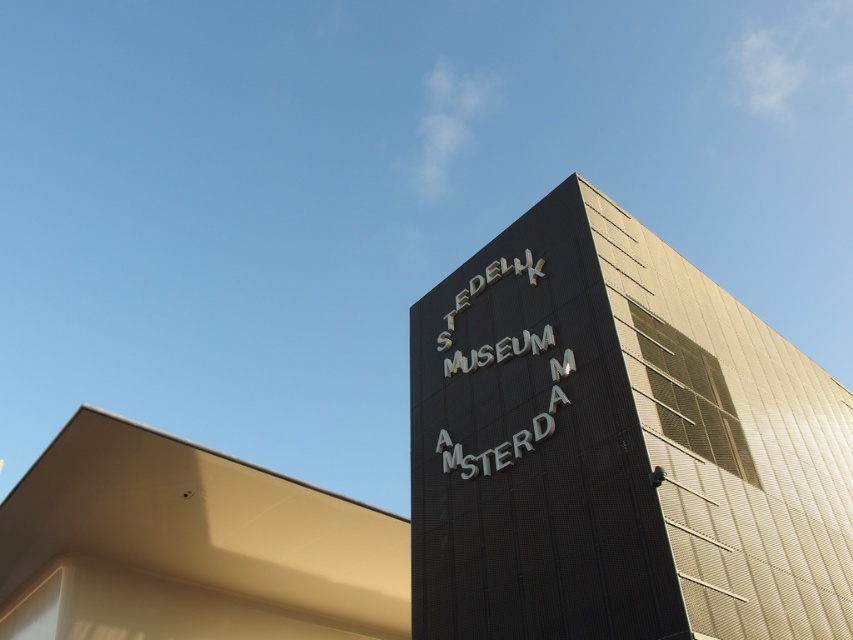
Question: Does black metallic sign at upper right have a lesser width compared to smooth beige roof at upper left?

Choices:
 (A) no
 (B) yes

Answer: (B)

Question: Is black metallic sign at upper right below smooth beige roof at upper left?

Choices:
 (A) no
 (B) yes

Answer: (A)

Question: Which point is closer to the camera?

Choices:
 (A) (160, 561)
 (B) (448, 609)

Answer: (B)

Question: Can you confirm if black metallic sign at upper right is positioned to the left of smooth beige roof at upper left?

Choices:
 (A) no
 (B) yes

Answer: (A)

Question: Which of the following is the closest to the observer?

Choices:
 (A) black metallic sign at upper right
 (B) smooth beige roof at upper left

Answer: (A)